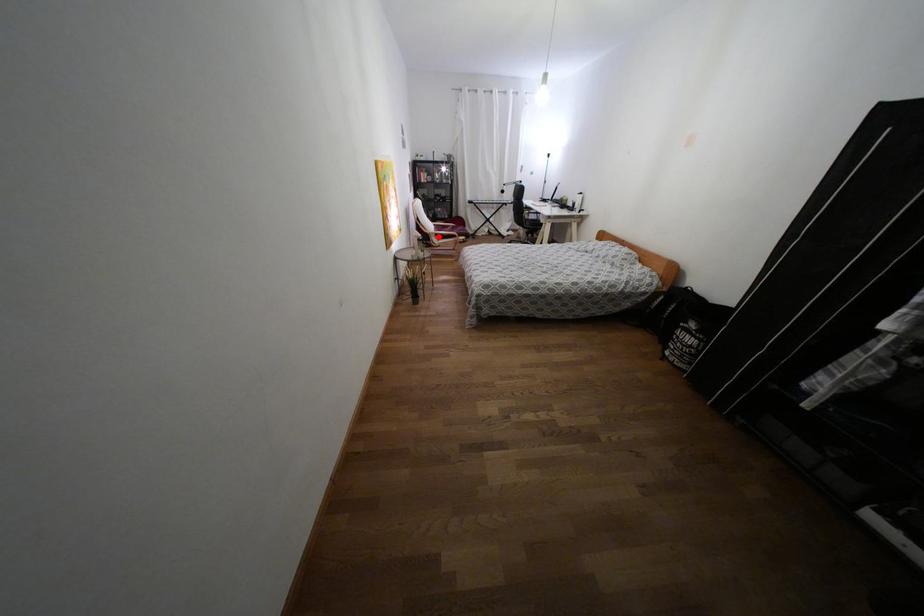
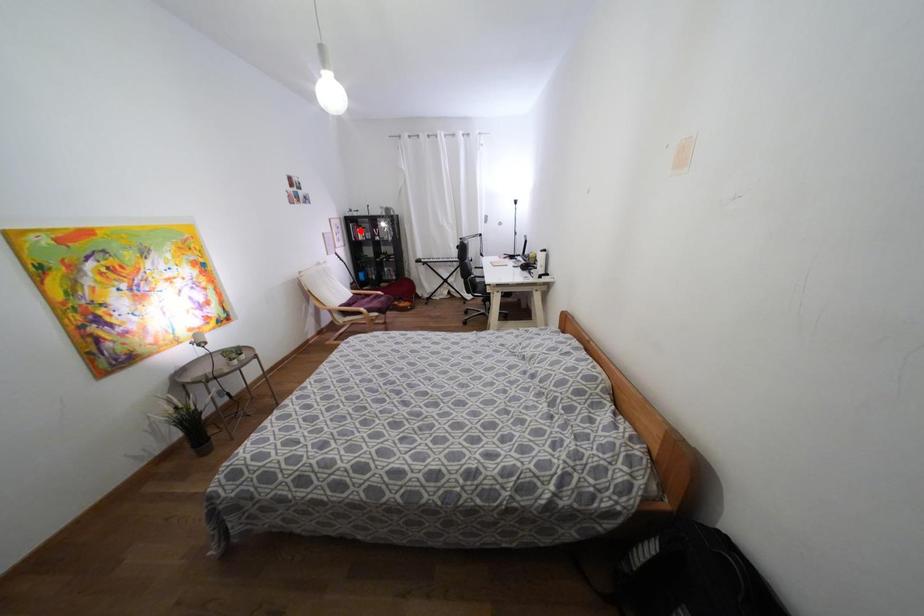
I am providing you with two images of the same scene from different viewpoints. A red point is marked on the first image and another point is marked on the second image. Is the red point in image1 aligned with the point shown in image2?

No